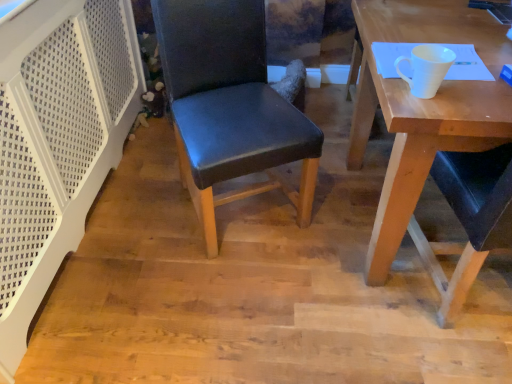
Where is `free point to the right of white matte cup at upper right`? The image size is (512, 384). free point to the right of white matte cup at upper right is located at coordinates (477, 93).